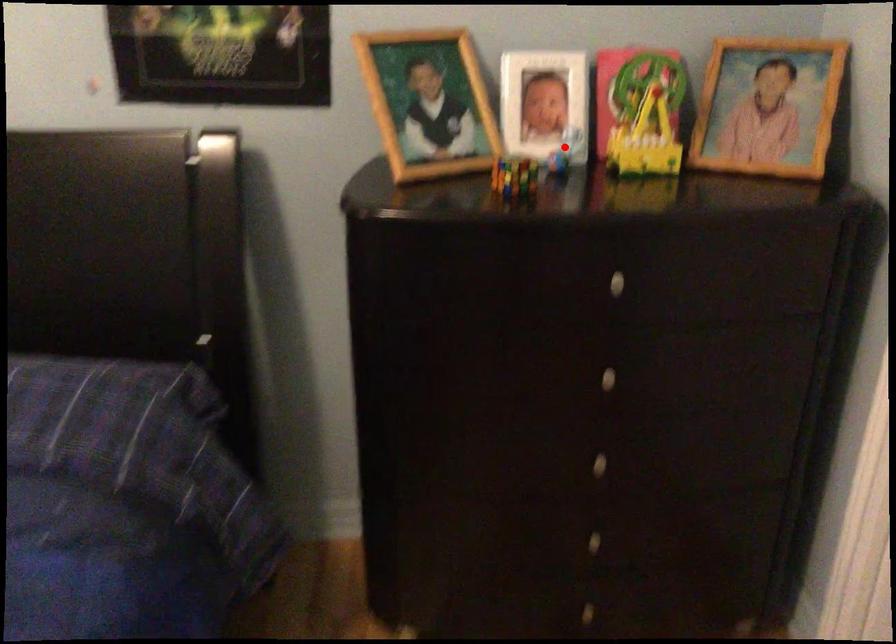
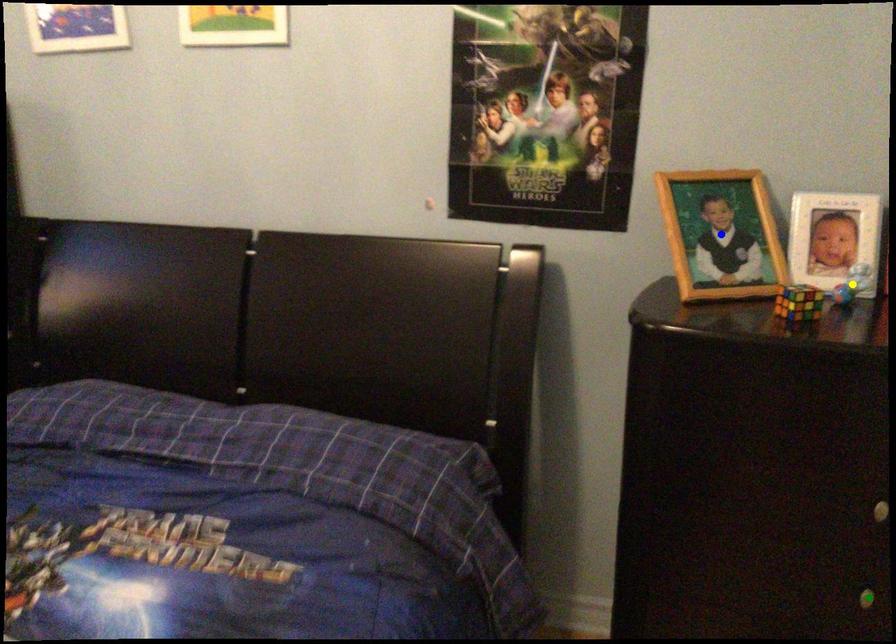
Question: I am providing you with two images of the same scene from different viewpoints. A red point is marked on the first image. You are given multiple points on the second image. Which mark in image 2 goes with the point in image 1?

Choices:
 (A) blue point
 (B) green point
 (C) yellow point

Answer: (C)